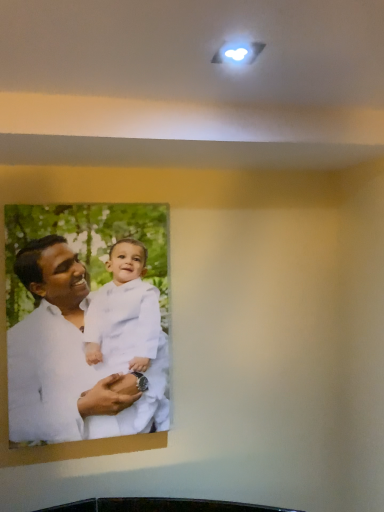
Question: Should I look upward or downward to see white paper photo at center?

Choices:
 (A) down
 (B) up

Answer: (A)